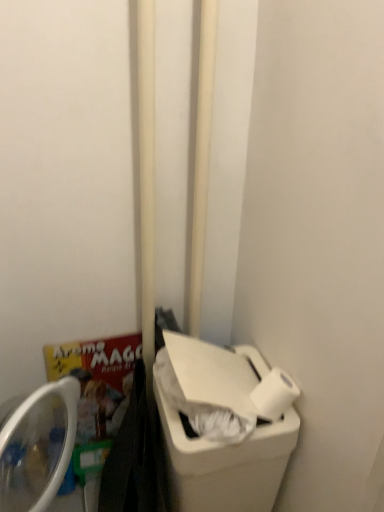
Question: Would you say white smooth pole at center, positioned as the second pole in right-to-left order, contains white matte toilet paper at lower right?

Choices:
 (A) yes
 (B) no

Answer: (B)

Question: Is white smooth pole at center, the first pole in the left-to-right sequence, far away from white matte toilet paper at lower right?

Choices:
 (A) yes
 (B) no

Answer: (B)

Question: Can you confirm if white smooth pole at center, the first pole in the left-to-right sequence, is positioned to the left of white matte toilet paper at lower right?

Choices:
 (A) no
 (B) yes

Answer: (B)

Question: Does white smooth pole at center, positioned as the second pole in right-to-left order, have a greater width compared to white matte toilet paper at lower right?

Choices:
 (A) yes
 (B) no

Answer: (A)

Question: From the image's perspective, is white smooth pole at center, positioned as the second pole in right-to-left order, over white matte toilet paper at lower right?

Choices:
 (A) yes
 (B) no

Answer: (A)

Question: Is white plastic recycling bin at lower right spatially inside white smooth pole at center, the first pole in the left-to-right sequence, or outside of it?

Choices:
 (A) outside
 (B) inside

Answer: (A)

Question: Is white plastic recycling bin at lower right to the left or to the right of white smooth pole at center, the first pole in the left-to-right sequence, in the image?

Choices:
 (A) left
 (B) right

Answer: (B)

Question: From the image's perspective, is white plastic recycling bin at lower right located above or below white smooth pole at center, the first pole in the left-to-right sequence?

Choices:
 (A) below
 (B) above

Answer: (A)

Question: From a real-world perspective, is white plastic recycling bin at lower right positioned above or below white smooth pole at center, the first pole in the left-to-right sequence?

Choices:
 (A) above
 (B) below

Answer: (B)

Question: In the image, is white matte toilet paper at lower right positioned in front of or behind white smooth pole at center, positioned as the second pole in right-to-left order?

Choices:
 (A) front
 (B) behind

Answer: (B)

Question: In the image, is white matte toilet paper at lower right on the left side or the right side of white smooth pole at center, the first pole in the left-to-right sequence?

Choices:
 (A) left
 (B) right

Answer: (B)

Question: Considering the positions of point (264, 410) and point (153, 309), is point (264, 410) closer or farther from the camera than point (153, 309)?

Choices:
 (A) closer
 (B) farther

Answer: (A)

Question: Is white matte toilet paper at lower right situated inside white smooth pole at center, positioned as the second pole in right-to-left order, or outside?

Choices:
 (A) inside
 (B) outside

Answer: (B)

Question: In the image, is white plastic recycling bin at lower right positioned in front of or behind white smooth pole at center, placed as the first pole when sorted from right to left?

Choices:
 (A) behind
 (B) front

Answer: (B)

Question: Is white plastic recycling bin at lower right bigger or smaller than white smooth pole at center, marked as the second pole in a left-to-right arrangement?

Choices:
 (A) big
 (B) small

Answer: (A)